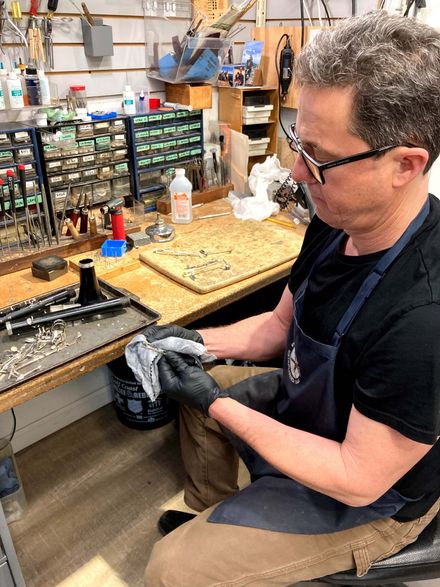
Where is `drawers`? The height and width of the screenshot is (587, 440). drawers is located at coordinates (97, 154).